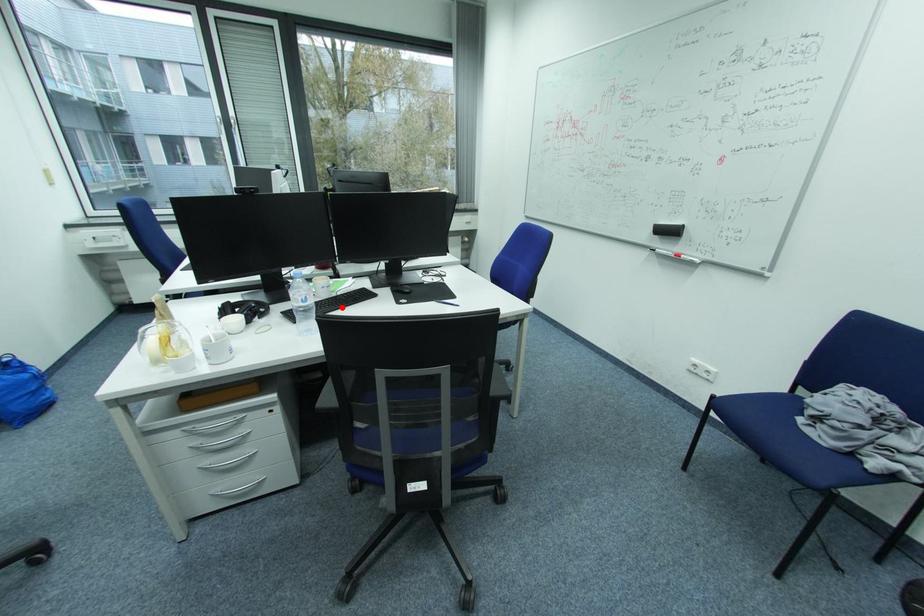
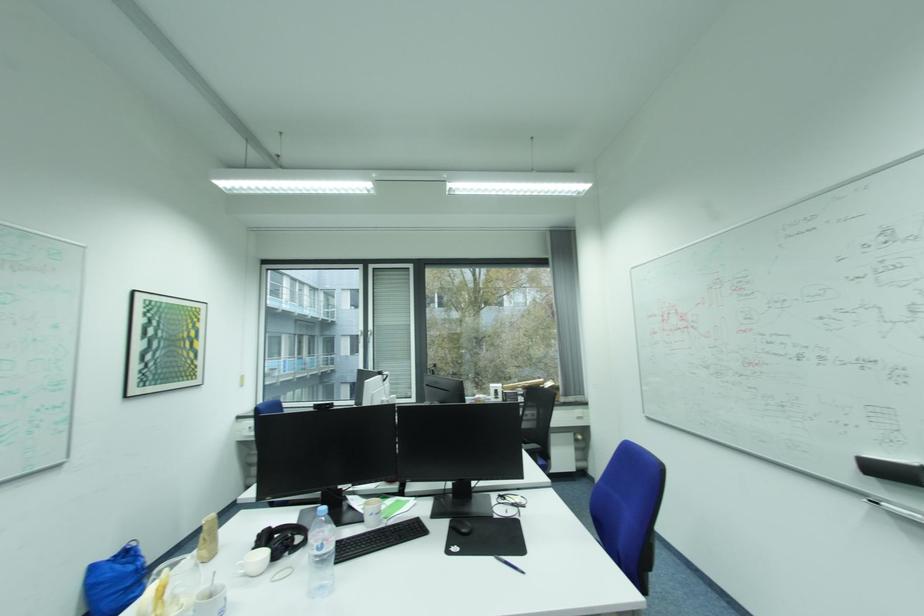
The point at the highlighted location is marked in the first image. Where is the corresponding point in the second image?

(378, 548)